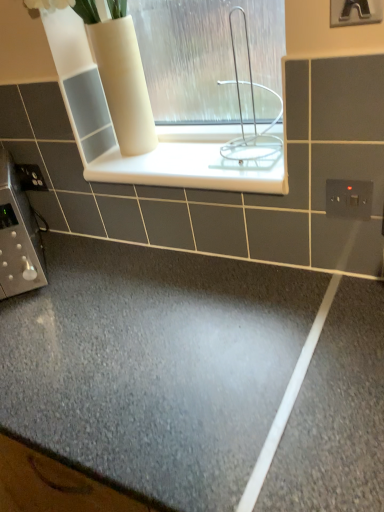
I want to click on free region on the left part of white wire rack at center, so click(181, 165).